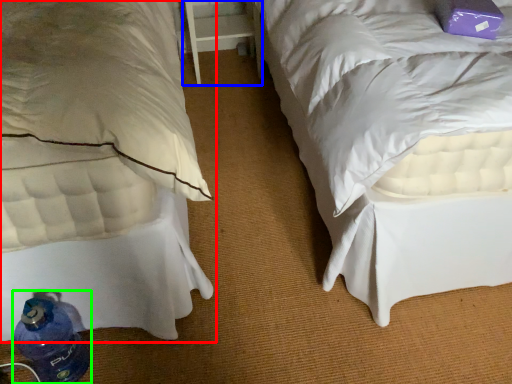
Question: Which is farther away from bed (highlighted by a red box)? table (highlighted by a blue box) or bottle (highlighted by a green box)?

Choices:
 (A) table
 (B) bottle

Answer: (A)